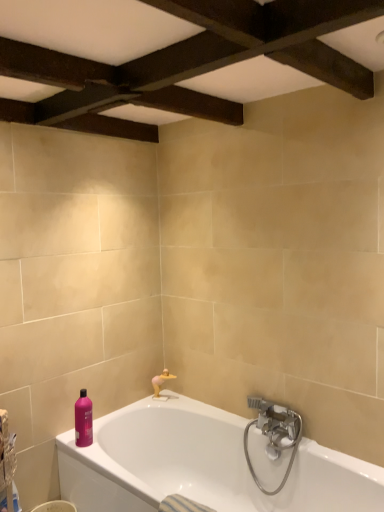
Image resolution: width=384 pixels, height=512 pixels. What are the coordinates of `free space in front of matte gold faucet at lower center` in the screenshot? It's located at (175, 405).